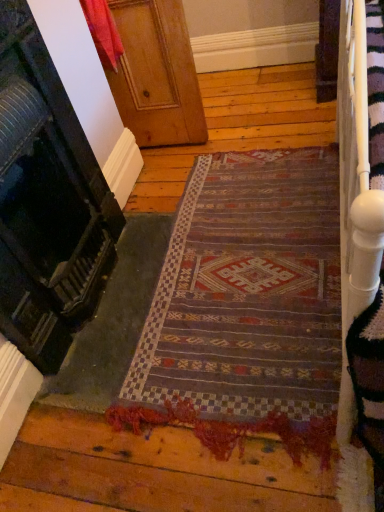
Locate an element on the screen. Image resolution: width=384 pixels, height=512 pixels. vacant area that is situated to the right of wooden at left, which is the second door in bottom-to-top order is located at coordinates (244, 127).